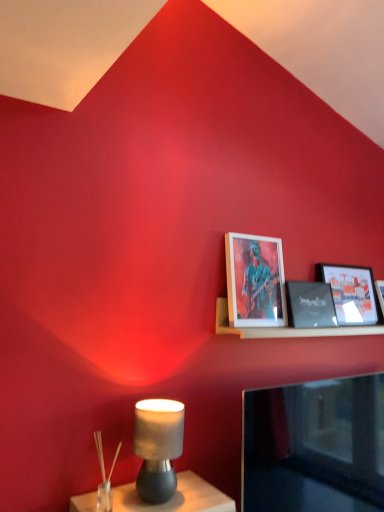
Question: Considering the relative sizes of matte gray lamp at lower left and matte black picture frame at upper right, acting as the 2th picture frame starting from the left, in the image provided, is matte gray lamp at lower left bigger than matte black picture frame at upper right, acting as the 2th picture frame starting from the left,?

Choices:
 (A) no
 (B) yes

Answer: (B)

Question: Can you confirm if matte gray lamp at lower left is wider than matte black picture frame at upper right, acting as the 2th picture frame starting from the left?

Choices:
 (A) no
 (B) yes

Answer: (B)

Question: Are matte gray lamp at lower left and matte black picture frame at upper right, acting as the 2th picture frame starting from the left, beside each other?

Choices:
 (A) yes
 (B) no

Answer: (B)

Question: From a real-world perspective, does matte gray lamp at lower left stand above matte black picture frame at upper right, the second picture frame viewed from the right?

Choices:
 (A) no
 (B) yes

Answer: (A)

Question: Is matte gray lamp at lower left closer to the viewer compared to matte black picture frame at upper right, acting as the 2th picture frame starting from the left?

Choices:
 (A) yes
 (B) no

Answer: (A)

Question: Considering the positions of wooden shelf at upper right and matte gray lamp at lower left in the image, is wooden shelf at upper right wider or thinner than matte gray lamp at lower left?

Choices:
 (A) thin
 (B) wide

Answer: (B)

Question: Would you say wooden shelf at upper right is to the left or to the right of matte gray lamp at lower left in the picture?

Choices:
 (A) left
 (B) right

Answer: (B)

Question: In terms of height, does wooden shelf at upper right look taller or shorter compared to matte gray lamp at lower left?

Choices:
 (A) short
 (B) tall

Answer: (A)

Question: Considering their positions, is wooden shelf at upper right located in front of or behind matte gray lamp at lower left?

Choices:
 (A) front
 (B) behind

Answer: (B)

Question: Considering the positions of matte gray lamp at lower left and matte black picture frame at upper right, the 1th picture frame viewed from the right, in the image, is matte gray lamp at lower left wider or thinner than matte black picture frame at upper right, the 1th picture frame viewed from the right,?

Choices:
 (A) thin
 (B) wide

Answer: (B)

Question: In the image, is matte gray lamp at lower left on the left side or the right side of matte black picture frame at upper right, placed as the third picture frame when sorted from left to right?

Choices:
 (A) left
 (B) right

Answer: (A)

Question: Based on their sizes in the image, would you say matte gray lamp at lower left is bigger or smaller than matte black picture frame at upper right, placed as the third picture frame when sorted from left to right?

Choices:
 (A) small
 (B) big

Answer: (A)

Question: Choose the correct answer: Is matte gray lamp at lower left inside matte black picture frame at upper right, the 1th picture frame viewed from the right, or outside it?

Choices:
 (A) outside
 (B) inside

Answer: (A)

Question: Is matte black picture frame at upper right, acting as the 2th picture frame starting from the left, bigger or smaller than matte black picture frame at upper right, the 1th picture frame viewed from the right?

Choices:
 (A) big
 (B) small

Answer: (B)

Question: Choose the correct answer: Is matte black picture frame at upper right, acting as the 2th picture frame starting from the left, inside matte black picture frame at upper right, placed as the third picture frame when sorted from left to right, or outside it?

Choices:
 (A) inside
 (B) outside

Answer: (B)